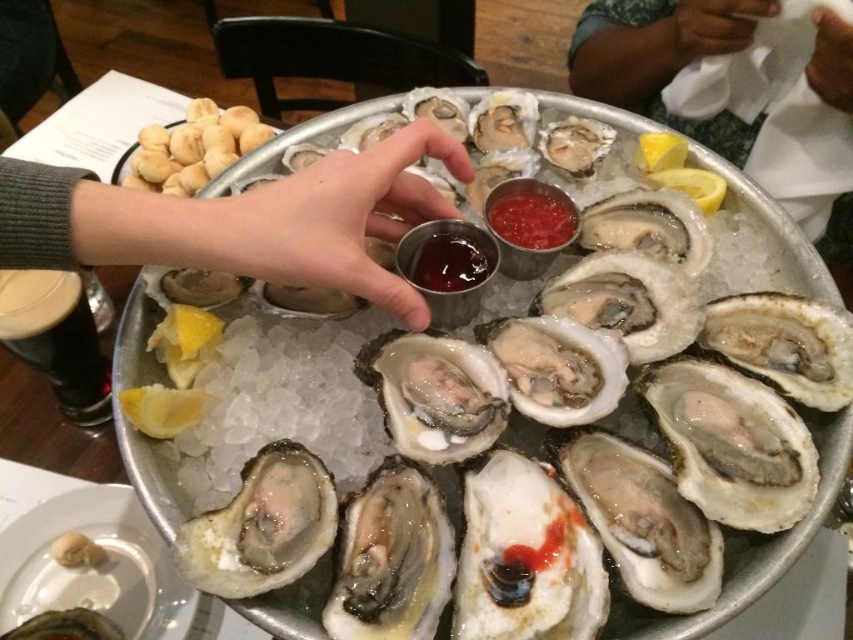
What is the spatial location of the dark skin tone at upper right in the image?

The dark skin tone at upper right is located at point coordinates of (735, 92).

You are a photographer trying to capture the seafood platter. You notice two points on the tray marked as point [346,244] and point [173,396]. Which point should you focus on to ensure it appears clearer in the photo?

Point [346,244] is closer to the camera than point [173,396], so focusing on point [346,244] will ensure it appears clearer in the photo.